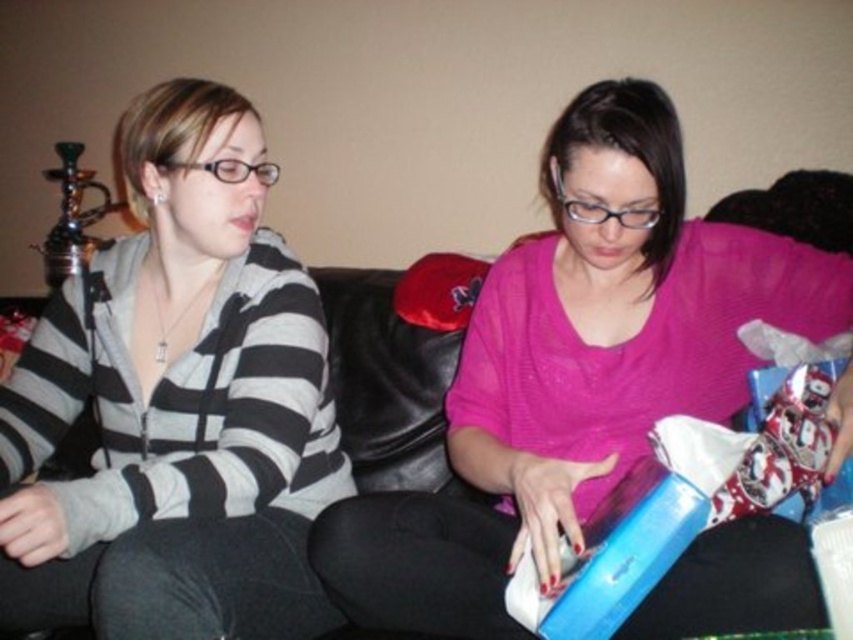
Which is above, pink sheer sweater at center or matte gray hoodie at left?

Positioned higher is matte gray hoodie at left.

Does point (671, 198) come behind point (4, 531)?

Yes, point (671, 198) is farther from viewer.

Find the location of a particular element. This screenshot has height=640, width=853. pink sheer sweater at center is located at coordinates (575, 369).

Is pink sheer sweater at center below black leather couch at center?

Actually, pink sheer sweater at center is above black leather couch at center.

Does pink sheer sweater at center have a larger size compared to black leather couch at center?

Yes.

Does point (595, 332) lie in front of point (531, 513)?

No, it is behind (531, 513).

The height and width of the screenshot is (640, 853). I want to click on pink sheer sweater at center, so click(575, 369).

Is matte gray hoodie at left bigger than black leather couch at center?

Yes, matte gray hoodie at left is bigger than black leather couch at center.

Identify the location of matte gray hoodie at left. The height and width of the screenshot is (640, 853). (177, 401).

Is point (13, 582) in front of point (848, 371)?

No, (13, 582) is behind (848, 371).

At what (x,y) coordinates should I click in order to perform the action: click on matte gray hoodie at left. Please return your answer as a coordinate pair (x, y). This screenshot has width=853, height=640. Looking at the image, I should click on (177, 401).